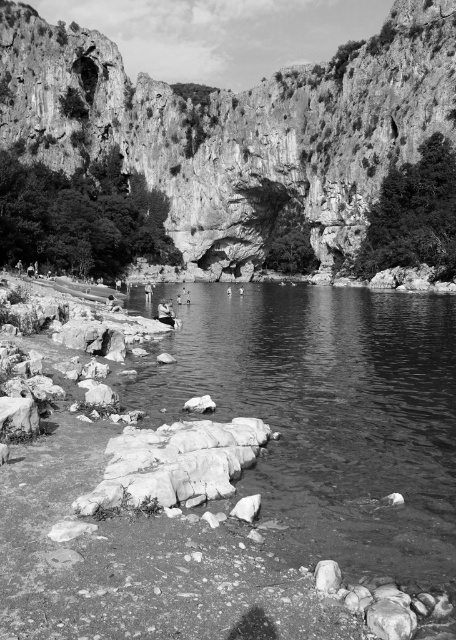
Question: Is rugged stone cliff at upper center wider than transparent water at lower left?

Choices:
 (A) yes
 (B) no

Answer: (A)

Question: Is transparent water at lower left bigger than smooth gray rock at lower left?

Choices:
 (A) no
 (B) yes

Answer: (B)

Question: Which object is positioned farthest from the rugged stone cliff at upper center?

Choices:
 (A) smooth gray rock at lower left
 (B) transparent water at lower left

Answer: (A)

Question: Does rugged stone cliff at upper center appear on the right side of transparent water at lower left?

Choices:
 (A) yes
 (B) no

Answer: (B)

Question: Among these objects, which one is farthest from the camera?

Choices:
 (A) rugged stone cliff at upper center
 (B) transparent water at lower left

Answer: (A)

Question: Which object appears farthest from the camera in this image?

Choices:
 (A) smooth gray rock at lower left
 (B) rugged stone cliff at upper center
 (C) transparent water at lower left

Answer: (B)